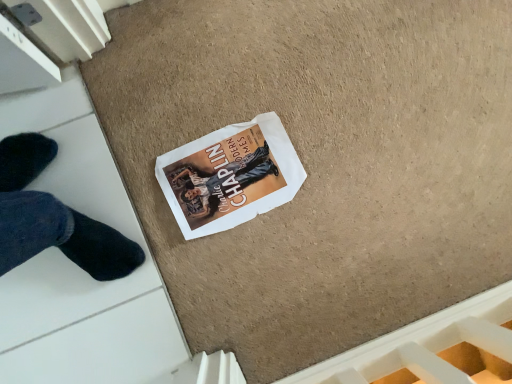
Where is `vacant space to the right of white paper magazine at center`? The width and height of the screenshot is (512, 384). vacant space to the right of white paper magazine at center is located at coordinates (321, 240).